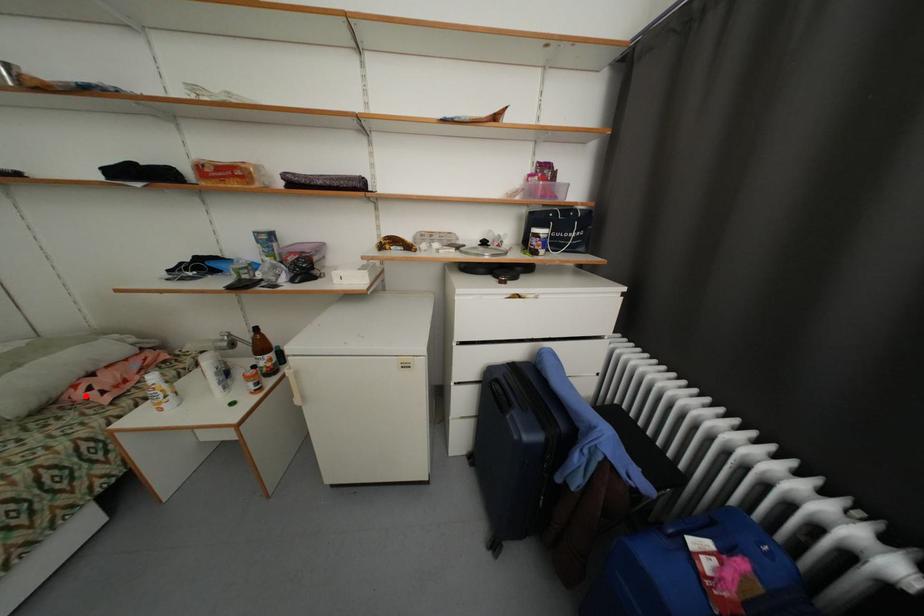
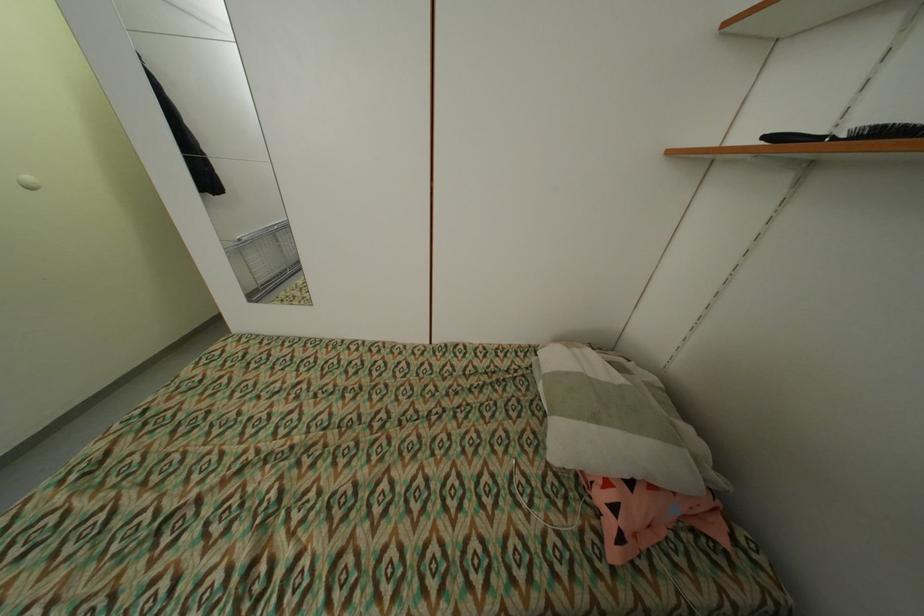
Question: I am providing you with two images of the same scene from different viewpoints. In image1, a red point is highlighted. Considering the same 3D point in image2, which of the following is correct?

Choices:
 (A) It is closer
 (B) It is farther

Answer: (B)